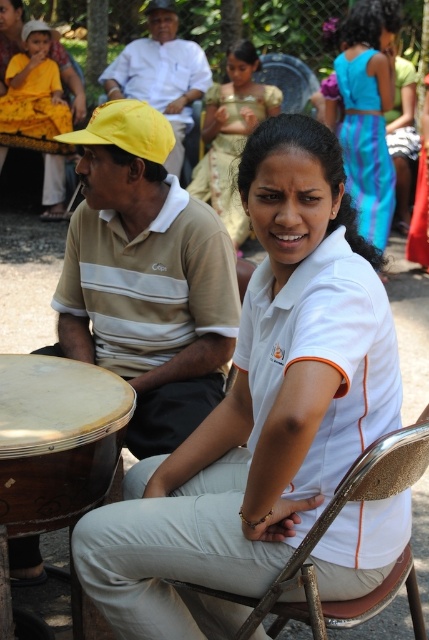
Question: Is matte yellow cap at left below blue silk dress at upper right?

Choices:
 (A) yes
 (B) no

Answer: (A)

Question: Which object is the closest to the brown wooden chair at center?

Choices:
 (A) white matte shirt at center
 (B) blue silk dress at upper right
 (C) wooden drum at lower left

Answer: (A)

Question: From the image, what is the correct spatial relationship of gold satin sari at center in relation to yellow fabric dress at upper left?

Choices:
 (A) below
 (B) above

Answer: (A)

Question: Among these points, which one is nearest to the camera?

Choices:
 (A) (223, 96)
 (B) (178, 108)

Answer: (A)

Question: Which object appears farthest from the camera in this image?

Choices:
 (A) matte yellow cap at left
 (B) yellow fabric dress at upper left
 (C) gold satin sari at center

Answer: (B)

Question: Is yellow fabric cap at left bigger than yellow fabric dress at upper left?

Choices:
 (A) no
 (B) yes

Answer: (B)